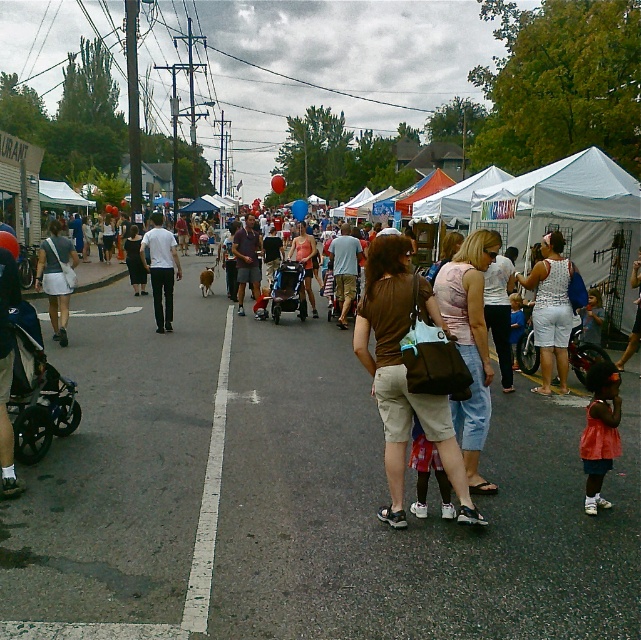
Question: Which point is farther from the camera taking this photo?

Choices:
 (A) (272, 294)
 (B) (337, 236)

Answer: (B)

Question: Can you confirm if white fabric tent at center is positioned to the right of pink fabric dress at lower right?

Choices:
 (A) no
 (B) yes

Answer: (A)

Question: Can you confirm if orange fabric dress at lower right is wider than matte gray shirt at center?

Choices:
 (A) yes
 (B) no

Answer: (B)

Question: Does orange fabric dress at lower right lie behind matte white bag at left?

Choices:
 (A) no
 (B) yes

Answer: (A)

Question: Which of the following is the closest to the observer?

Choices:
 (A) (160, 326)
 (B) (1, 369)

Answer: (B)

Question: Among these objects, which one is nearest to the camera?

Choices:
 (A) matte white bag at left
 (B) brown fabric purse at center

Answer: (B)